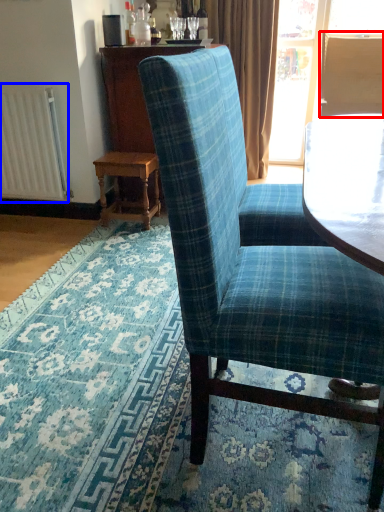
Question: Among these objects, which one is nearest to the camera, back (highlighted by a red box) or radiator (highlighted by a blue box)?

Choices:
 (A) back
 (B) radiator

Answer: (B)